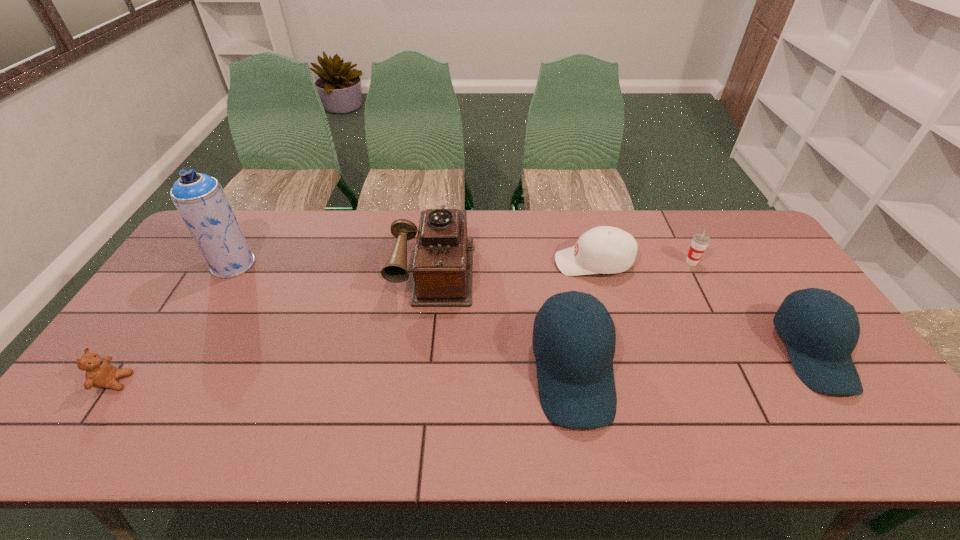
I want to click on aerosol can located in the left edge section of the desktop, so point(199,198).

You are a GUI agent. You are given a task and a screenshot of the screen. Output one action in this format:
    pyautogui.click(x=<x>, y=<y>)
    Task: Click on the teddy bear at the left edge
    The height and width of the screenshot is (540, 960).
    Given the screenshot: What is the action you would take?
    pyautogui.click(x=100, y=373)

Where is `object that is at the right edge`? object that is at the right edge is located at coordinates (820, 351).

This screenshot has width=960, height=540. Identify the location of object that is positioned at the far left corner. 199,198.

Where is `object that is at the near left corner`? The image size is (960, 540). object that is at the near left corner is located at coordinates (100, 373).

Where is `object that is at the near right corner`? object that is at the near right corner is located at coordinates (820, 351).

The width and height of the screenshot is (960, 540). In the image, there is a desktop. In order to click on vacant space at the far edge in this screenshot , I will do `click(498, 219)`.

Where is `vacant region at the left edge of the desktop`? The image size is (960, 540). vacant region at the left edge of the desktop is located at coordinates (166, 307).

In the image, there is a desktop. At what (x,y) coordinates should I click in order to perform the action: click on vacant space at the right edge. Please return your answer as a coordinate pair (x, y). The image size is (960, 540). Looking at the image, I should click on (753, 271).

This screenshot has height=540, width=960. In the image, there is a desktop. Find the location of `vacant space at the far left corner`. vacant space at the far left corner is located at coordinates (189, 252).